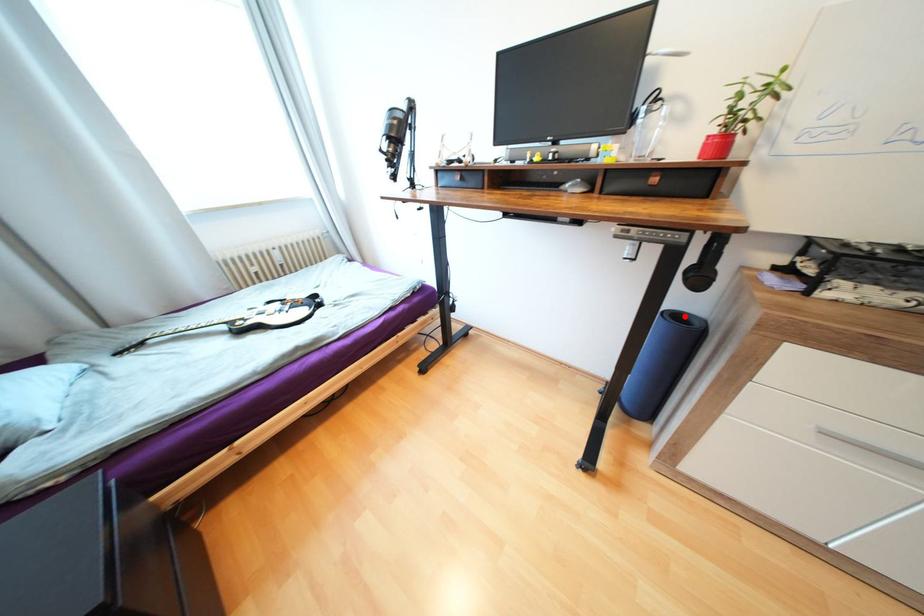
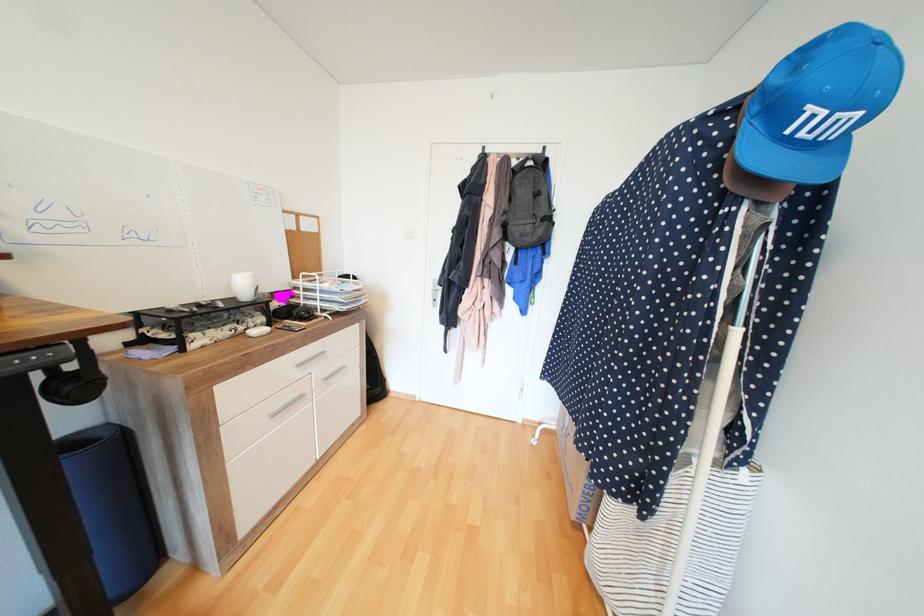
The point at the highlighted location is marked in the first image. Where is the corresponding point in the second image?

(80, 443)